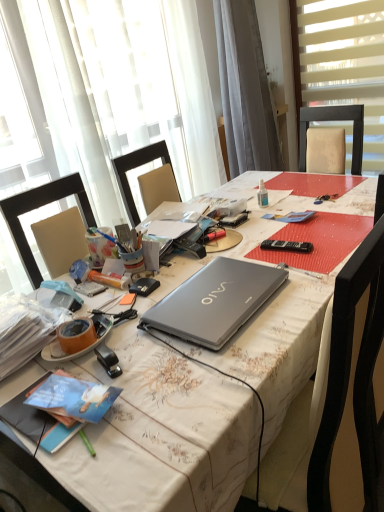
Question: Should I look upward or downward to see clear plastic bottle at center?

Choices:
 (A) down
 (B) up

Answer: (B)

Question: Is black plastic remote control at center shorter than translucent fabric at upper left, placed as the 1th window when sorted from left to right?

Choices:
 (A) no
 (B) yes

Answer: (B)

Question: Is black plastic remote control at center closer to the viewer compared to translucent fabric at upper left, which appears as the second window when viewed from the right?

Choices:
 (A) no
 (B) yes

Answer: (B)

Question: Is black plastic remote control at center completely or partially outside of translucent fabric at upper left, placed as the 1th window when sorted from left to right?

Choices:
 (A) no
 (B) yes

Answer: (B)

Question: From a real-world perspective, does black plastic remote control at center stand above translucent fabric at upper left, placed as the 1th window when sorted from left to right?

Choices:
 (A) no
 (B) yes

Answer: (A)

Question: Considering the relative sizes of black plastic remote control at center and translucent fabric at upper left, which appears as the second window when viewed from the right, in the image provided, is black plastic remote control at center smaller than translucent fabric at upper left, which appears as the second window when viewed from the right,?

Choices:
 (A) no
 (B) yes

Answer: (B)

Question: Is black plastic remote control at center positioned far away from translucent fabric at upper left, which appears as the second window when viewed from the right?

Choices:
 (A) no
 (B) yes

Answer: (B)

Question: Is white blinds at upper right, which is the second window from left to right, surrounding clear plastic bottle at center?

Choices:
 (A) no
 (B) yes

Answer: (A)

Question: Is white blinds at upper right, the first window positioned from the right, positioned far away from clear plastic bottle at center?

Choices:
 (A) no
 (B) yes

Answer: (B)

Question: Are white blinds at upper right, the first window positioned from the right, and clear plastic bottle at center making contact?

Choices:
 (A) yes
 (B) no

Answer: (B)

Question: Is white blinds at upper right, the first window positioned from the right, to the right of clear plastic bottle at center from the viewer's perspective?

Choices:
 (A) yes
 (B) no

Answer: (A)

Question: Can you confirm if white blinds at upper right, the first window positioned from the right, is smaller than clear plastic bottle at center?

Choices:
 (A) no
 (B) yes

Answer: (A)

Question: Can you confirm if white blinds at upper right, which is the second window from left to right, is taller than clear plastic bottle at center?

Choices:
 (A) no
 (B) yes

Answer: (B)

Question: Can you confirm if matte plastic pencil at center-left is positioned to the left of metallic silver laptop at center?

Choices:
 (A) no
 (B) yes

Answer: (B)